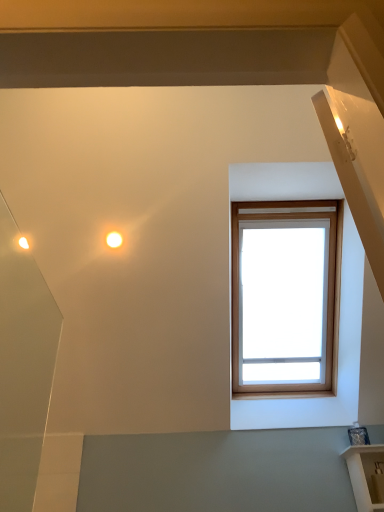
Question: From a real-world perspective, is matte white droplight at upper left on top of white glossy shelf at lower right?

Choices:
 (A) yes
 (B) no

Answer: (A)

Question: Considering the relative sizes of matte white droplight at upper left and white glossy shelf at lower right in the image provided, is matte white droplight at upper left smaller than white glossy shelf at lower right?

Choices:
 (A) no
 (B) yes

Answer: (B)

Question: Considering the relative positions of matte white droplight at upper left and white glossy shelf at lower right in the image provided, is matte white droplight at upper left to the left of white glossy shelf at lower right from the viewer's perspective?

Choices:
 (A) no
 (B) yes

Answer: (B)

Question: Would you say white glossy shelf at lower right is part of matte white droplight at upper left's contents?

Choices:
 (A) yes
 (B) no

Answer: (B)

Question: Can you confirm if matte white droplight at upper left is wider than white glossy shelf at lower right?

Choices:
 (A) yes
 (B) no

Answer: (B)

Question: Considering the relative positions of matte white droplight at upper left and white glossy shelf at lower right in the image provided, is matte white droplight at upper left to the right of white glossy shelf at lower right from the viewer's perspective?

Choices:
 (A) yes
 (B) no

Answer: (B)

Question: Is white glossy shelf at lower right at the right side of matte white droplight at upper left?

Choices:
 (A) no
 (B) yes

Answer: (B)

Question: From the image's perspective, is white glossy shelf at lower right located above matte white droplight at upper left?

Choices:
 (A) yes
 (B) no

Answer: (B)

Question: Is white glossy shelf at lower right not near matte white droplight at upper left?

Choices:
 (A) no
 (B) yes

Answer: (B)

Question: Can we say white glossy shelf at lower right lies outside matte white droplight at upper left?

Choices:
 (A) no
 (B) yes

Answer: (B)

Question: From a real-world perspective, is white glossy shelf at lower right located beneath matte white droplight at upper left?

Choices:
 (A) yes
 (B) no

Answer: (A)

Question: Does white glossy shelf at lower right have a lesser height compared to matte white droplight at upper left?

Choices:
 (A) yes
 (B) no

Answer: (B)

Question: In terms of width, does white glossy shelf at lower right look wider or thinner when compared to matte white droplight at upper left?

Choices:
 (A) wide
 (B) thin

Answer: (A)